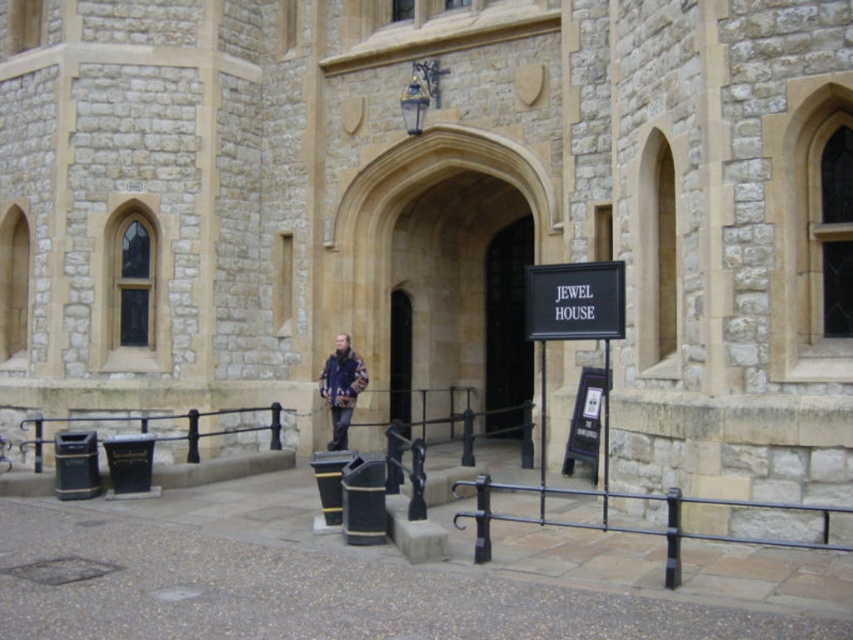
You are standing in front of the historic stone building and want to enter through the dark stone archway at center. Based on its coordinates, in which direction should you walk to reach it?

The dark stone archway at center is located at coordinates point [508,328], so you should walk straight ahead towards the center of the building to reach it.

You are standing in front of the historic stone building and want to enter through the dark stone archway at center. However, you are wearing the flannel jacket at center. Can you pass through the archway without removing your jacket?

The dark stone archway at center has a larger size compared to flannel jacket at center, so you can pass through the archway without removing your jacket.